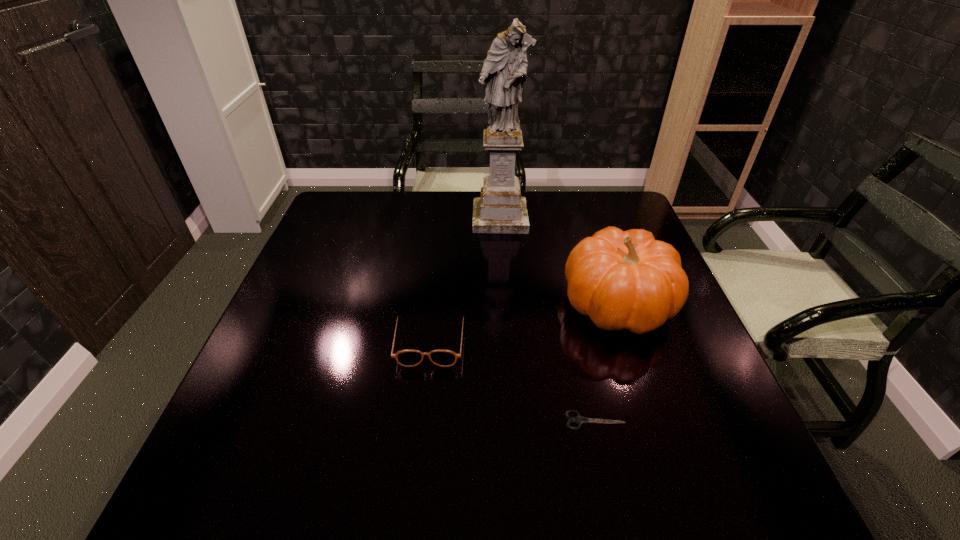
Where is `the third closest object to the second tallest object`? The height and width of the screenshot is (540, 960). the third closest object to the second tallest object is located at coordinates 408,358.

This screenshot has width=960, height=540. Identify the location of blank area in the image that satisfies the following two spatial constraints: 1. on the front-facing side of the sculpture; 2. on the right side of the second tallest object. (505, 304).

Where is `vacant space that satisfies the following two spatial constraints: 1. on the front-facing side of the shears; 2. on the right side of the leftmost object`? This screenshot has width=960, height=540. vacant space that satisfies the following two spatial constraints: 1. on the front-facing side of the shears; 2. on the right side of the leftmost object is located at coordinates click(421, 420).

This screenshot has width=960, height=540. Identify the location of vacant region that satisfies the following two spatial constraints: 1. on the front-facing side of the nearest object; 2. on the right side of the sculpture. (513, 420).

Locate an element on the screen. free space that satisfies the following two spatial constraints: 1. on the front-facing side of the shears; 2. on the right side of the leftmost object is located at coordinates (421, 420).